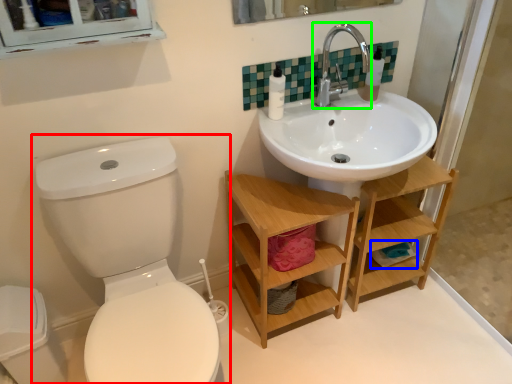
Question: Estimate the real-world distances between objects in this image. Which object is closer to toilet (highlighted by a red box), toilet paper (highlighted by a blue box) or tap (highlighted by a green box)?

Choices:
 (A) toilet paper
 (B) tap

Answer: (B)